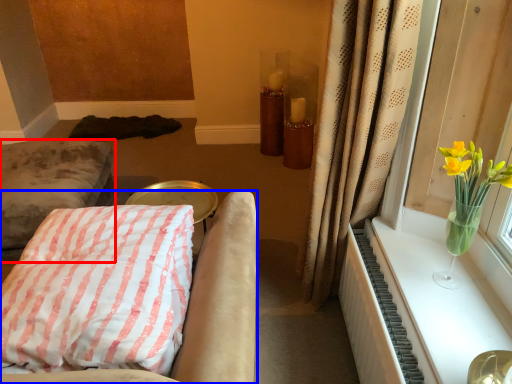
Question: Which of the following is the closest to the observer, furniture (highlighted by a red box) or furniture (highlighted by a blue box)?

Choices:
 (A) furniture
 (B) furniture

Answer: (B)